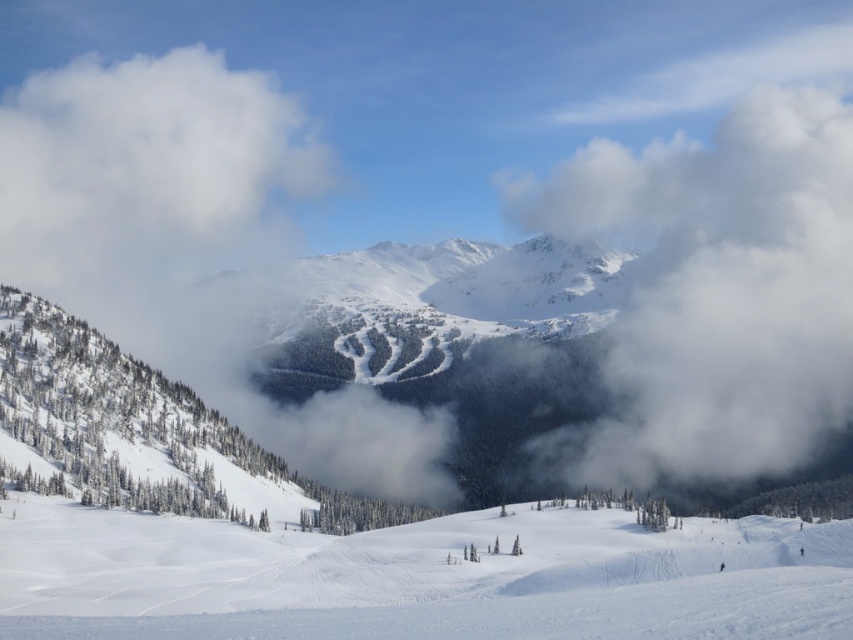
Does white snow ski slope at lower center have a greater height compared to white fluffy cloud at upper left?

No, white snow ski slope at lower center is not taller than white fluffy cloud at upper left.

What do you see at coordinates (422, 579) in the screenshot? The height and width of the screenshot is (640, 853). I see `white snow ski slope at lower center` at bounding box center [422, 579].

You are a GUI agent. You are given a task and a screenshot of the screen. Output one action in this format:
    pyautogui.click(x=<x>, y=<y>)
    Task: Click on the white snow ski slope at lower center
    
    Given the screenshot: What is the action you would take?
    pyautogui.click(x=422, y=579)

This screenshot has height=640, width=853. In order to click on white snow ski slope at lower center in this screenshot , I will do `click(422, 579)`.

Who is more distant from viewer, (770, 333) or (32, 90)?

The point (32, 90) is more distant.

Does white fluffy cloud at upper right appear on the left side of white fluffy cloud at upper left?

Incorrect, white fluffy cloud at upper right is not on the left side of white fluffy cloud at upper left.

The image size is (853, 640). Find the location of `white fluffy cloud at upper right`. white fluffy cloud at upper right is located at coordinates point(718,289).

Can you confirm if white snow ski slope at lower center is positioned below white fluffy cloud at upper right?

Correct, white snow ski slope at lower center is located below white fluffy cloud at upper right.

This screenshot has height=640, width=853. Describe the element at coordinates (422, 579) in the screenshot. I see `white snow ski slope at lower center` at that location.

What are the coordinates of `white snow ski slope at lower center` in the screenshot? It's located at (422, 579).